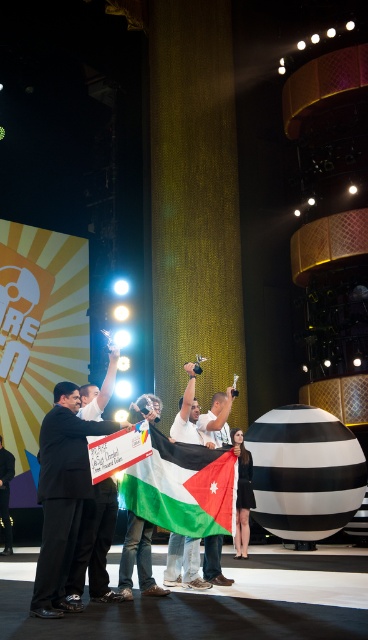
Question: Estimate the real-world distances between objects in this image. Which object is closer to the green and white fabric flag at center?

Choices:
 (A) white cotton dress at center
 (B) white cotton shirt at center

Answer: (B)

Question: Among these points, which one is nearest to the camera?

Choices:
 (A) (128, 593)
 (B) (190, 547)
 (C) (248, 509)
 (D) (192, 477)

Answer: (A)

Question: Based on their relative distances, which object is nearer to the white cotton shirt at center?

Choices:
 (A) white cotton t-shirt at center
 (B) green and white fabric flag at center
 (C) white cotton dress at center

Answer: (B)

Question: Can you confirm if green and white fabric flag at center is smaller than white cotton shirt at center?

Choices:
 (A) yes
 (B) no

Answer: (B)

Question: Where is white cotton shirt at center located in relation to white cotton dress at center in the image?

Choices:
 (A) above
 (B) below

Answer: (A)

Question: From the image, what is the correct spatial relationship of green and white fabric flag at center in relation to white cotton shirt at center?

Choices:
 (A) below
 (B) above

Answer: (B)